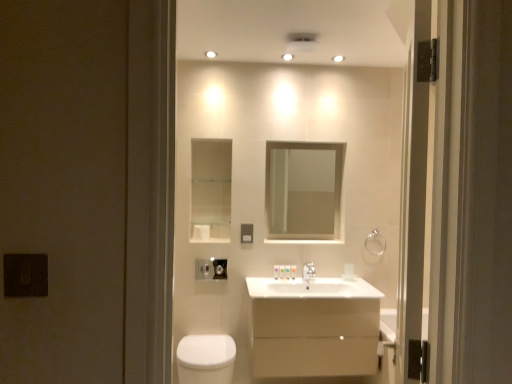
Locate an element on the screen. This screenshot has height=384, width=512. vacant area that is situated to the right of translucent plastic tube at center, placed as the 1th toiletry when sorted from left to right is located at coordinates (293, 279).